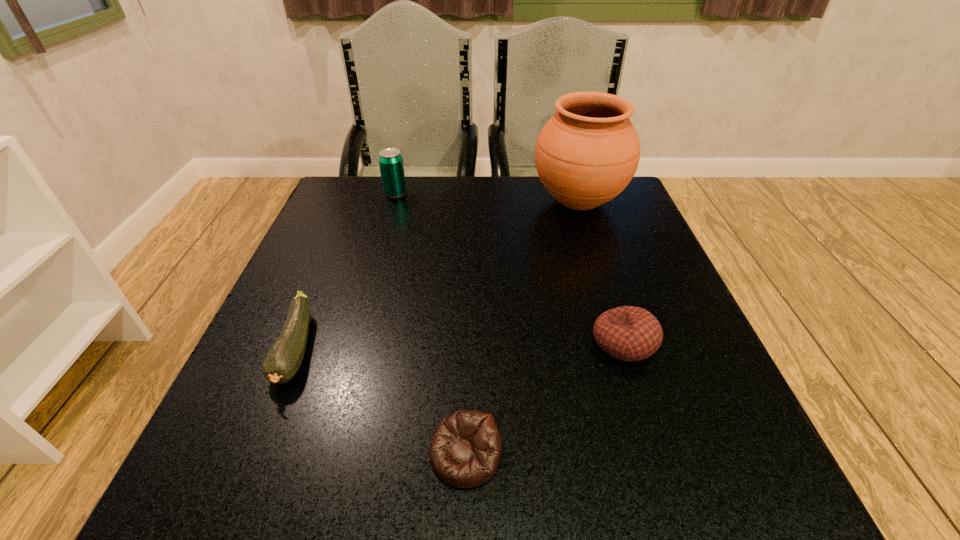
The height and width of the screenshot is (540, 960). I want to click on pottery, so click(586, 154).

This screenshot has height=540, width=960. I want to click on beer can, so [391, 166].

This screenshot has height=540, width=960. Find the location of `the second tallest object`. the second tallest object is located at coordinates (391, 166).

Identify the location of the taller beanbag. (628, 333).

Identify the location of the right beanbag. This screenshot has width=960, height=540. (628, 333).

Where is `the leftmost object`? The width and height of the screenshot is (960, 540). the leftmost object is located at coordinates (284, 359).

Find the location of `the nearer beanbag`. the nearer beanbag is located at coordinates (465, 450).

The height and width of the screenshot is (540, 960). In order to click on the left beanbag in this screenshot , I will do `click(465, 450)`.

The image size is (960, 540). In order to click on vacant space situated 0.160m on the left of the pottery in this screenshot , I will do coord(468,201).

At what (x,y) coordinates should I click in order to perform the action: click on vacant space located 0.060m on the left of the second tallest object. Please return your answer as a coordinate pair (x, y). Looking at the image, I should click on (360, 194).